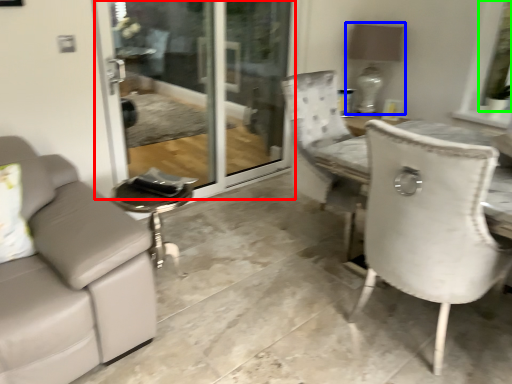
Question: Which object is the farthest from screen door (highlighted by a red box)? Choose among these: lamp (highlighted by a blue box) or window screen (highlighted by a green box).

Choices:
 (A) lamp
 (B) window screen

Answer: (B)